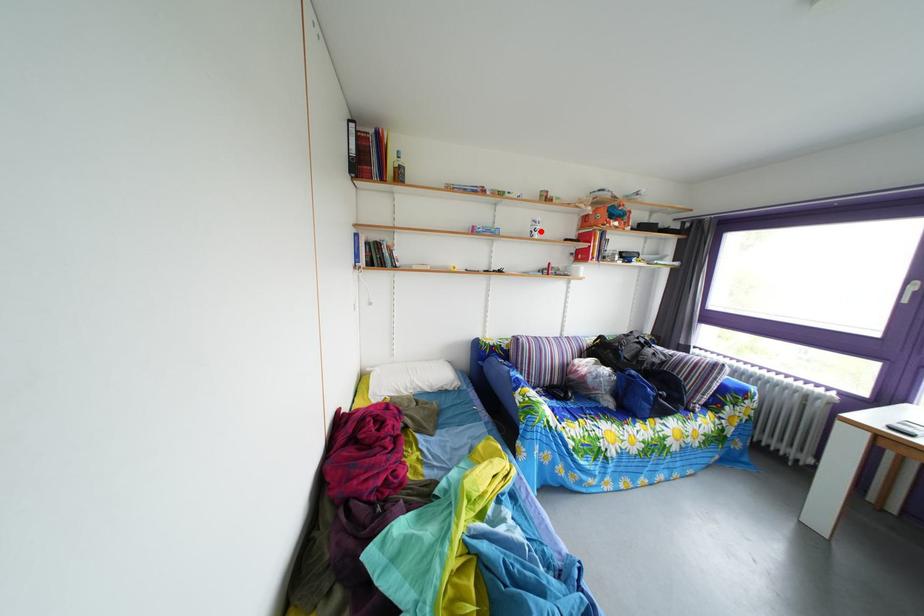
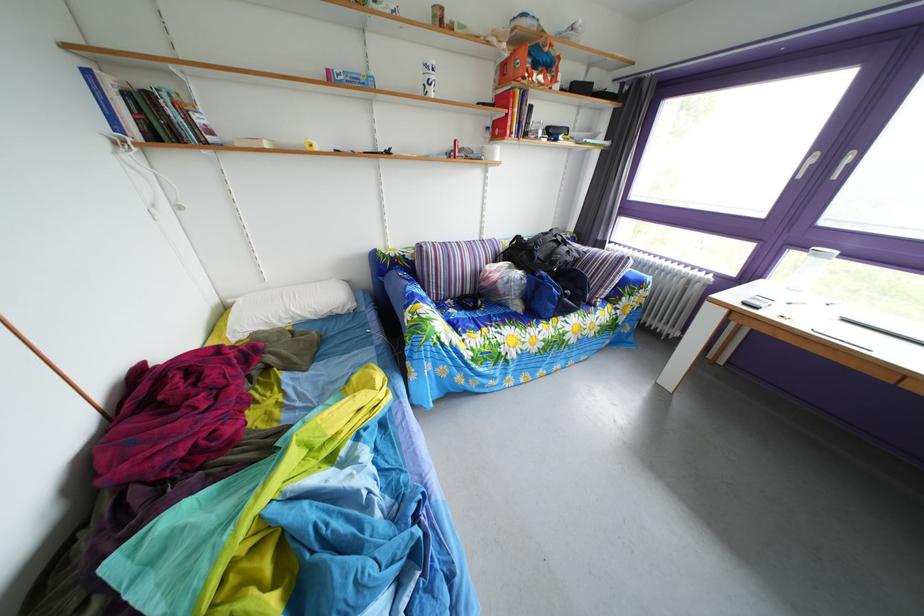
Find the pixel in the second image that matches the highlighted location in the first image.

(432, 79)